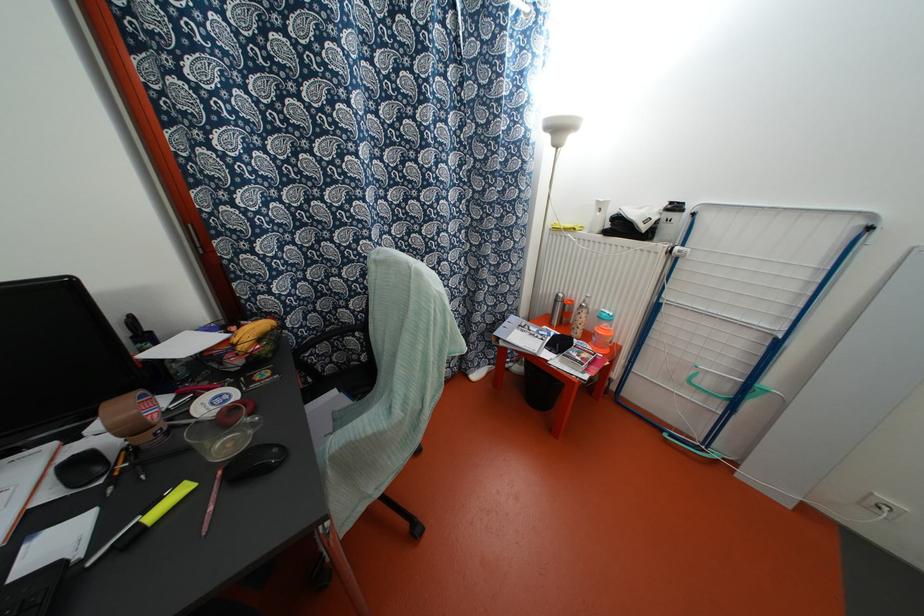
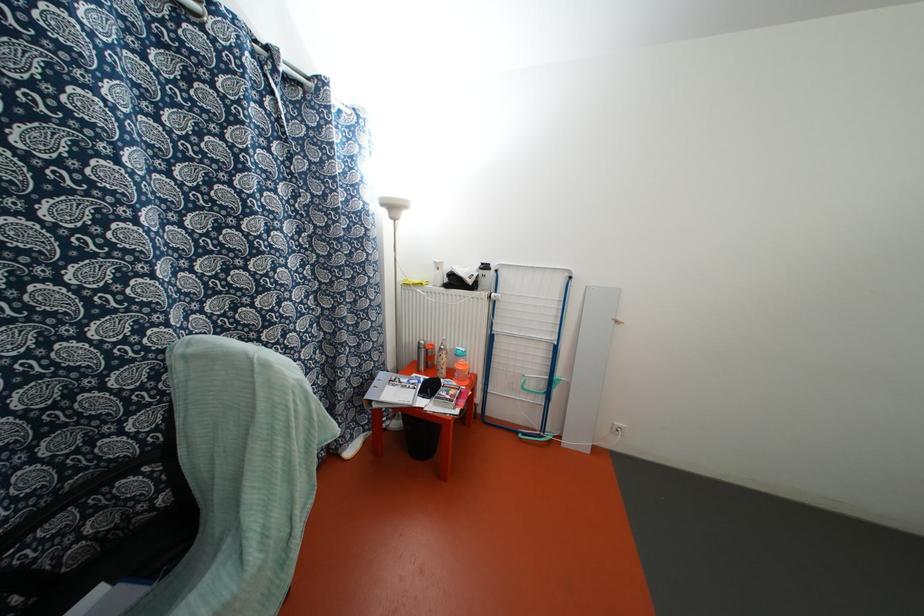
Question: The camera is either moving clockwise (left) or counter-clockwise (right) around the object. The first image is from the beginning of the video and the second image is from the end. Is the camera moving left or right when shooting the video?

Choices:
 (A) Left
 (B) Right

Answer: (A)